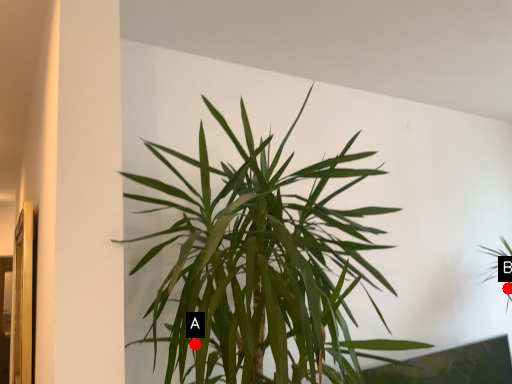
Question: Two points are circled on the image, labeled by A and B beside each circle. Which point appears farthest from the camera in this image?

Choices:
 (A) A is further
 (B) B is further

Answer: (B)